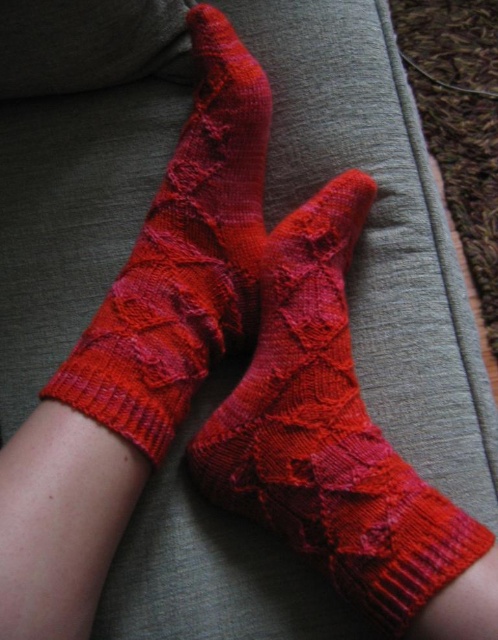
Consider the image. Can you confirm if matte red yarn socks at center is smaller than matte red knitted socks at center?

No.

Does matte red yarn socks at center appear on the right side of matte red knitted socks at center?

Yes, matte red yarn socks at center is to the right of matte red knitted socks at center.

Who is more forward, (x=336, y=452) or (x=247, y=248)?

Point (x=336, y=452) is in front.

At what (x,y) coordinates should I click in order to perform the action: click on matte red yarn socks at center. Please return your answer as a coordinate pair (x, y). The height and width of the screenshot is (640, 498). Looking at the image, I should click on (332, 436).